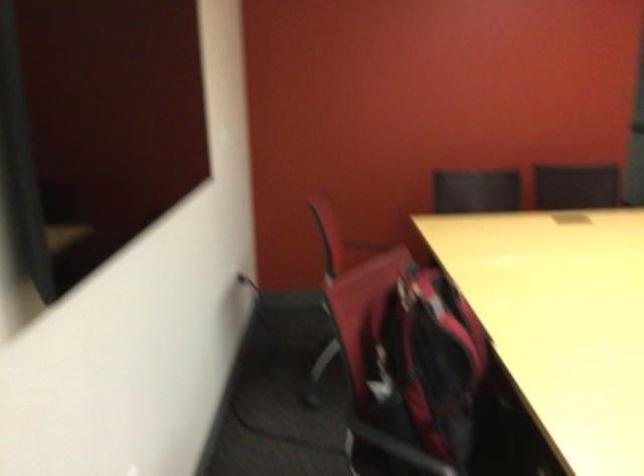
This screenshot has width=644, height=476. What are the coordinates of `black chair armrest` in the screenshot? It's located at (334, 377).